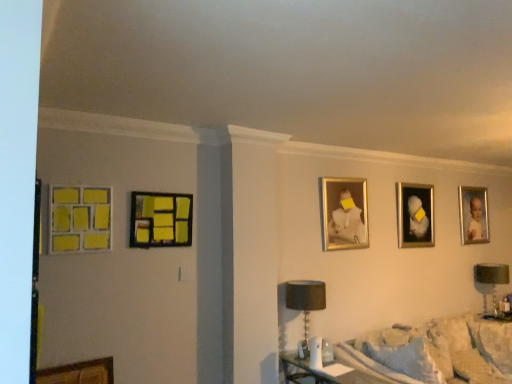
Question: Does green fabric lampshade at right, which is counted as the 2th table lamp, starting from the front, have a larger size compared to black fabric lampshade at lower center, arranged as the first table lamp when viewed from the left?

Choices:
 (A) no
 (B) yes

Answer: (A)

Question: Is green fabric lampshade at right, the first table lamp viewed from the back, to the right of black fabric lampshade at lower center, the 2th table lamp in the right-to-left sequence, from the viewer's perspective?

Choices:
 (A) no
 (B) yes

Answer: (B)

Question: Is green fabric lampshade at right, which is counted as the 2th table lamp, starting from the front, positioned with its back to black fabric lampshade at lower center, the second table lamp in the back-to-front sequence?

Choices:
 (A) no
 (B) yes

Answer: (A)

Question: Considering the relative sizes of green fabric lampshade at right, which is counted as the 2th table lamp, starting from the front, and black fabric lampshade at lower center, the 1th table lamp in the front-to-back sequence, in the image provided, is green fabric lampshade at right, which is counted as the 2th table lamp, starting from the front, shorter than black fabric lampshade at lower center, the 1th table lamp in the front-to-back sequence,?

Choices:
 (A) no
 (B) yes

Answer: (A)

Question: Does green fabric lampshade at right, the first table lamp viewed from the back, come behind black fabric lampshade at lower center, the second table lamp in the back-to-front sequence?

Choices:
 (A) yes
 (B) no

Answer: (A)

Question: Is point (69, 192) positioned closer to the camera than point (145, 198)?

Choices:
 (A) farther
 (B) closer

Answer: (B)

Question: In the image, is matte yellow tiles at left, acting as the 5th picture frame starting from the right, on the left side or the right side of matte wood picture frame at left, the fourth picture frame viewed from the right?

Choices:
 (A) right
 (B) left

Answer: (B)

Question: Considering their positions, is matte yellow tiles at left, the 1th picture frame from the front, located in front of or behind matte wood picture frame at left, acting as the fourth picture frame starting from the back?

Choices:
 (A) front
 (B) behind

Answer: (A)

Question: Is matte yellow tiles at left, the fifth picture frame viewed from the back, taller or shorter than matte wood picture frame at left, the 2th picture frame in the left-to-right sequence?

Choices:
 (A) short
 (B) tall

Answer: (B)

Question: Considering the positions of black fabric lampshade at lower center, the 2th table lamp in the right-to-left sequence, and green fabric lampshade at right, which is counted as the 2th table lamp, starting from the front, in the image, is black fabric lampshade at lower center, the 2th table lamp in the right-to-left sequence, taller or shorter than green fabric lampshade at right, which is counted as the 2th table lamp, starting from the front,?

Choices:
 (A) short
 (B) tall

Answer: (A)

Question: Is point (305, 294) closer or farther from the camera than point (493, 266)?

Choices:
 (A) closer
 (B) farther

Answer: (A)

Question: From a real-world perspective, relative to green fabric lampshade at right, the first table lamp viewed from the back, is black fabric lampshade at lower center, arranged as the first table lamp when viewed from the left, vertically above or below?

Choices:
 (A) below
 (B) above

Answer: (B)

Question: From the image's perspective, is black fabric lampshade at lower center, the 1th table lamp in the front-to-back sequence, positioned above or below green fabric lampshade at right, acting as the second table lamp starting from the left?

Choices:
 (A) below
 (B) above

Answer: (B)

Question: In terms of height, does matte yellow tiles at left, acting as the 5th picture frame starting from the right, look taller or shorter compared to gold-framed portrait at upper right, arranged as the 1th picture frame when viewed from the right?

Choices:
 (A) short
 (B) tall

Answer: (A)

Question: In terms of size, does matte yellow tiles at left, the 1th picture frame viewed from the left, appear bigger or smaller than gold-framed portrait at upper right, marked as the 5th picture frame in a front-to-back arrangement?

Choices:
 (A) small
 (B) big

Answer: (A)